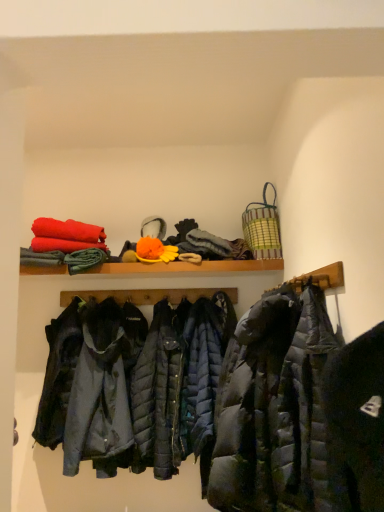
Question: Is green striped woven basket at upper right outside of wooden shelf at upper center?

Choices:
 (A) no
 (B) yes

Answer: (B)

Question: From a real-world perspective, does green striped woven basket at upper right sit lower than wooden shelf at upper center?

Choices:
 (A) yes
 (B) no

Answer: (B)

Question: Does green striped woven basket at upper right turn towards wooden shelf at upper center?

Choices:
 (A) no
 (B) yes

Answer: (A)

Question: From the image's perspective, is green striped woven basket at upper right located above wooden shelf at upper center?

Choices:
 (A) yes
 (B) no

Answer: (A)

Question: Is green striped woven basket at upper right smaller than wooden shelf at upper center?

Choices:
 (A) yes
 (B) no

Answer: (A)

Question: From the image's perspective, is green striped woven basket at upper right located above or below wooden shelf at upper center?

Choices:
 (A) below
 (B) above

Answer: (B)

Question: Based on their positions, is green striped woven basket at upper right located to the left or right of wooden shelf at upper center?

Choices:
 (A) left
 (B) right

Answer: (B)

Question: Considering the positions of green striped woven basket at upper right and wooden shelf at upper center in the image, is green striped woven basket at upper right taller or shorter than wooden shelf at upper center?

Choices:
 (A) tall
 (B) short

Answer: (A)

Question: Is point (276, 220) positioned closer to the camera than point (205, 265)?

Choices:
 (A) closer
 (B) farther

Answer: (A)

Question: Is dark gray quilted jacket at center situated inside wooden shelf at upper center or outside?

Choices:
 (A) inside
 (B) outside

Answer: (B)

Question: From a real-world perspective, is dark gray quilted jacket at center above or below wooden shelf at upper center?

Choices:
 (A) below
 (B) above

Answer: (A)

Question: Considering the positions of dark gray quilted jacket at center and wooden shelf at upper center in the image, is dark gray quilted jacket at center taller or shorter than wooden shelf at upper center?

Choices:
 (A) short
 (B) tall

Answer: (B)

Question: In the image, is dark gray quilted jacket at center positioned in front of or behind wooden shelf at upper center?

Choices:
 (A) behind
 (B) front

Answer: (B)

Question: In the image, is wooden shelf at upper center positioned in front of or behind green striped woven basket at upper right?

Choices:
 (A) behind
 (B) front

Answer: (A)

Question: Is wooden shelf at upper center to the left or to the right of green striped woven basket at upper right in the image?

Choices:
 (A) left
 (B) right

Answer: (A)